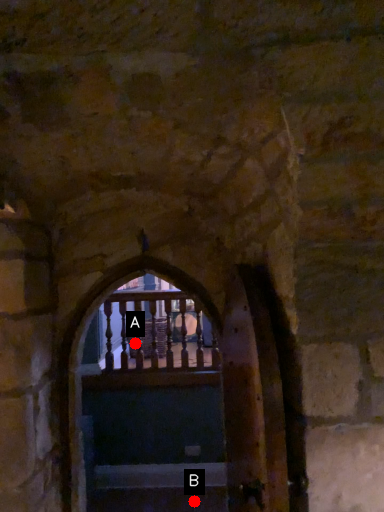
Question: Two points are circled on the image, labeled by A and B beside each circle. Which point appears closest to the camera in this image?

Choices:
 (A) A is closer
 (B) B is closer

Answer: (B)